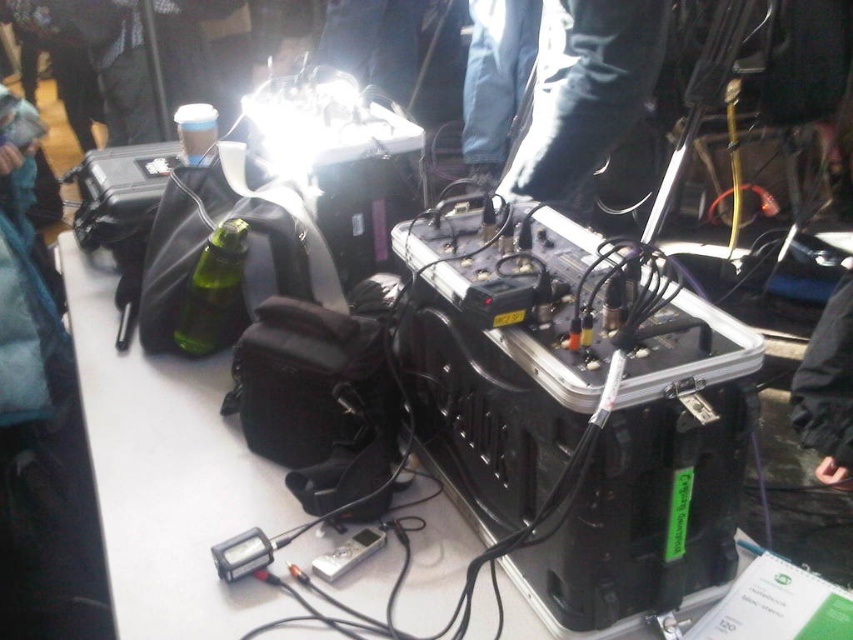
Question: Which point is closer to the camera?

Choices:
 (A) (834, 360)
 (B) (570, 4)

Answer: (B)

Question: Which point is closer to the camera taking this photo?

Choices:
 (A) (618, 124)
 (B) (824, 346)

Answer: (A)

Question: Can you confirm if black leather boots at upper center is bigger than black fabric jacket at lower right?

Choices:
 (A) yes
 (B) no

Answer: (A)

Question: Is the position of black leather boots at upper center less distant than that of black fabric jacket at lower right?

Choices:
 (A) yes
 (B) no

Answer: (A)

Question: Is black leather boots at upper center closer to the viewer compared to black fabric jacket at lower right?

Choices:
 (A) yes
 (B) no

Answer: (A)